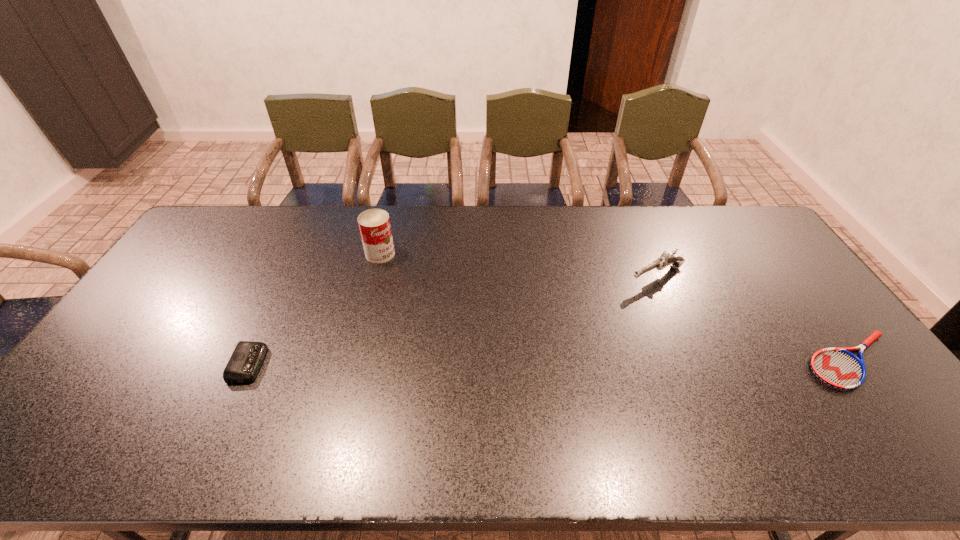
Identify the location of vacant area that lies between the leftmost object and the shortest object. (550, 362).

At what (x,y) coordinates should I click in order to perform the action: click on free space between the third shortest object and the can. Please return your answer as a coordinate pair (x, y). The height and width of the screenshot is (540, 960). Looking at the image, I should click on (518, 265).

The height and width of the screenshot is (540, 960). In order to click on free area in between the tallest object and the third object from left to right in this screenshot , I will do `click(518, 265)`.

Image resolution: width=960 pixels, height=540 pixels. I want to click on free area in between the alarm clock and the tallest object, so click(315, 309).

This screenshot has width=960, height=540. Identify the location of unoccupied area between the third object from right to left and the second shortest object. (315, 309).

This screenshot has width=960, height=540. Identify the location of the closest object relative to the third object from right to left. (247, 357).

What are the coordinates of `object that stands as the closest to the gun` in the screenshot? It's located at (838, 368).